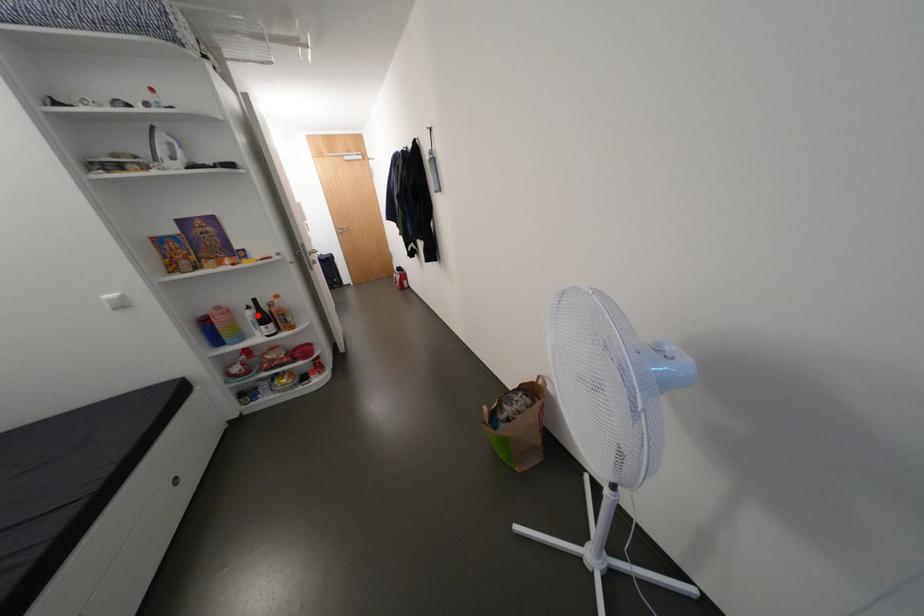
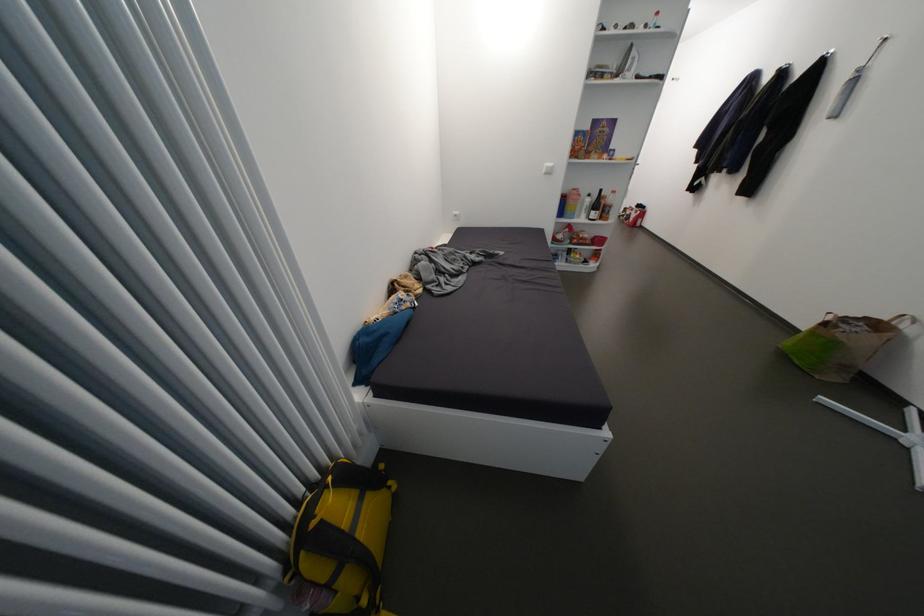
Question: I am providing you with two images of the same scene from different viewpoints. A red point is marked on the first image. Can you still see the location of the red point in image 2?

Choices:
 (A) Yes
 (B) No

Answer: (A)